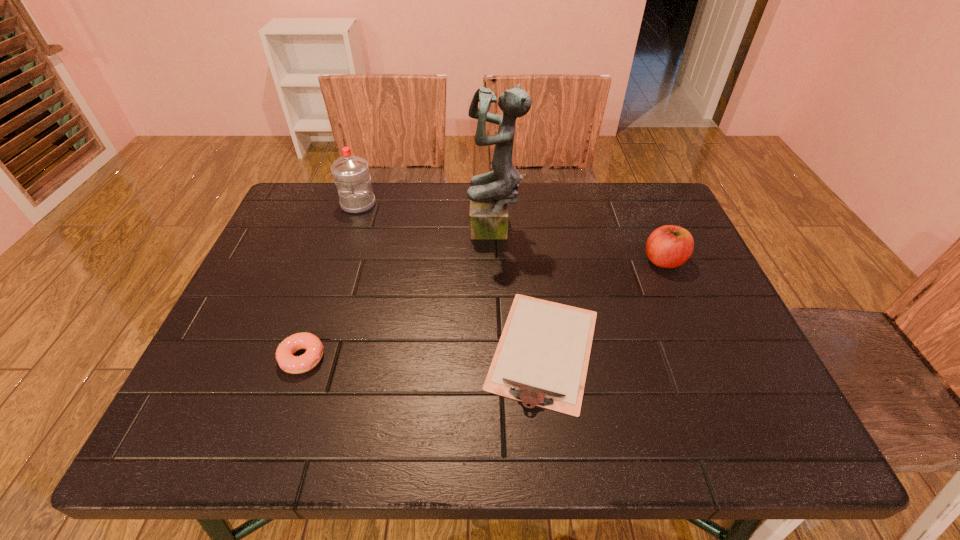
You are a GUI agent. You are given a task and a screenshot of the screen. Output one action in this format:
    pyautogui.click(x=<x>, y=<y>)
    Task: Click on the free space between the doughnut and the second tallest object
    The height and width of the screenshot is (540, 960).
    Given the screenshot: What is the action you would take?
    [330, 281]

Locate an element on the screen. This screenshot has width=960, height=540. blank region between the shortest object and the doughnut is located at coordinates (423, 353).

I want to click on free space between the fourth shortest object and the sculpture, so click(x=426, y=218).

The image size is (960, 540). I want to click on free space between the farthest object and the third tallest object, so click(x=511, y=232).

Identify the location of blank region between the doughnut and the third shortest object. (483, 309).

Where is `vacant space in between the rightmost object and the sculpture`? The width and height of the screenshot is (960, 540). vacant space in between the rightmost object and the sculpture is located at coordinates click(579, 246).

Locate an element on the screen. empty location between the farthest object and the shortest object is located at coordinates (451, 276).

Identify which object is the fourth closest to the fourth tallest object. Please provide its 2D coordinates. Your answer should be formatted as a tuple, i.e. [(x, y)], where the tuple contains the x and y coordinates of a point satisfying the conditions above.

[(669, 246)]

I want to click on object that stands as the fourth closest to the sculpture, so click(x=289, y=363).

The height and width of the screenshot is (540, 960). What are the coordinates of `free spot that satisfies the following two spatial constraints: 1. on the handle side of the water bottle; 2. on the right side of the third shortest object` in the screenshot? It's located at (340, 261).